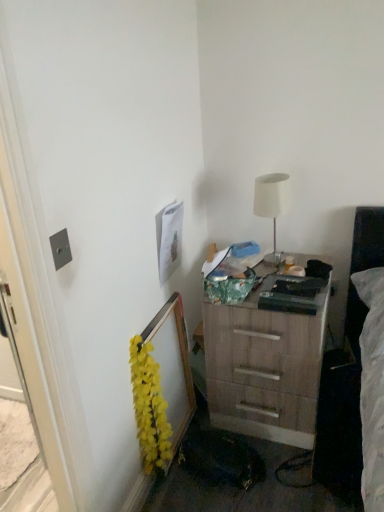
Question: Looking at their shapes, would you say wooden chest of drawers at lower right is wider or thinner than yellow artificial flowers at left?

Choices:
 (A) thin
 (B) wide

Answer: (B)

Question: Is wooden chest of drawers at lower right taller or shorter than yellow artificial flowers at left?

Choices:
 (A) tall
 (B) short

Answer: (A)

Question: Estimate the real-world distances between objects in this image. Which object is closer to the metallic silver outlet at left?

Choices:
 (A) yellow artificial flowers at left
 (B) wooden chest of drawers at lower right
 (C) white matte table lamp at upper right

Answer: (A)

Question: Based on their relative distances, which object is nearer to the metallic silver outlet at left?

Choices:
 (A) wooden chest of drawers at lower right
 (B) yellow artificial flowers at left
 (C) white matte table lamp at upper right

Answer: (B)